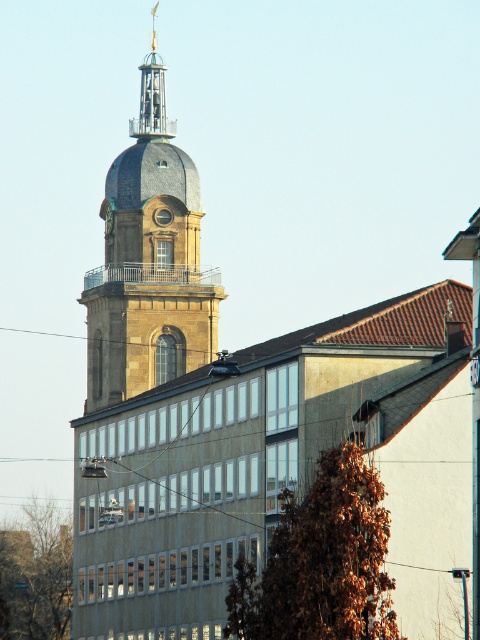
Question: Which point is farther to the camera?

Choices:
 (A) (164, 93)
 (B) (128, 285)

Answer: (A)

Question: Can you confirm if golden stone tower at upper center is bigger than polished brass clock tower at upper center?

Choices:
 (A) no
 (B) yes

Answer: (B)

Question: Does golden stone tower at upper center appear on the left side of polished brass clock tower at upper center?

Choices:
 (A) yes
 (B) no

Answer: (A)

Question: Is golden stone tower at upper center above polished brass clock tower at upper center?

Choices:
 (A) no
 (B) yes

Answer: (A)

Question: Which object appears farthest from the camera in this image?

Choices:
 (A) polished brass clock tower at upper center
 (B) golden stone tower at upper center

Answer: (A)